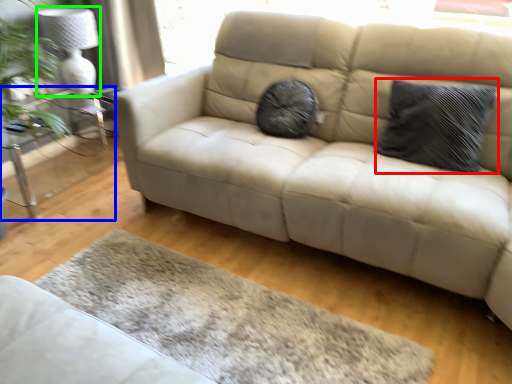
Question: Which is farther away from pillow (highlighted by a red box)? table (highlighted by a blue box) or lamp (highlighted by a green box)?

Choices:
 (A) table
 (B) lamp

Answer: (A)